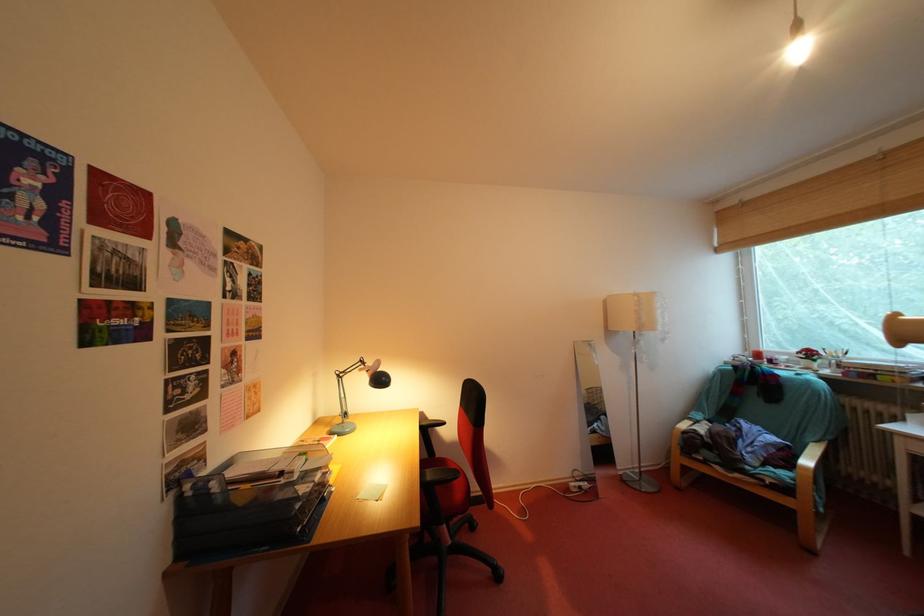
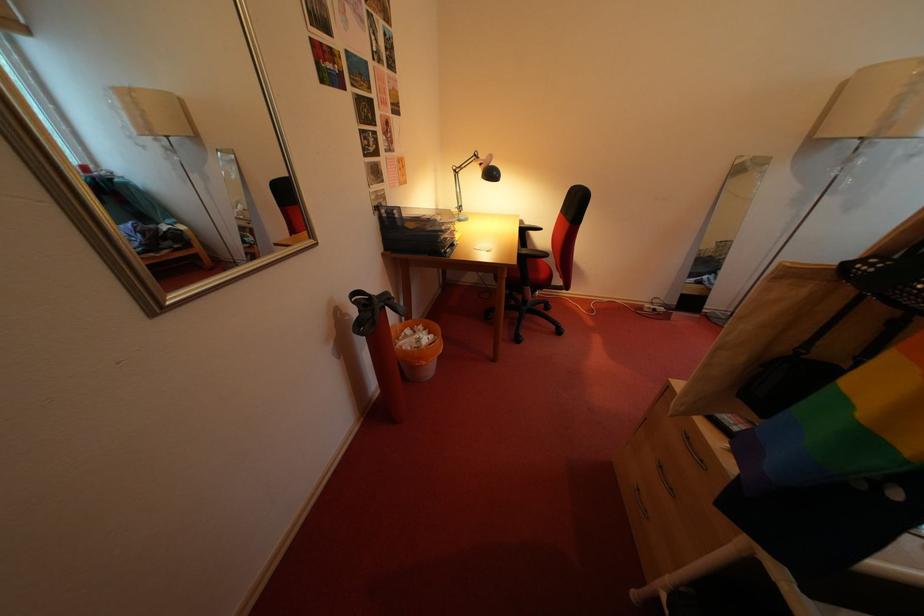
Where in the second image is the point corresponding to pixel 440 480 from the first image?

(535, 257)